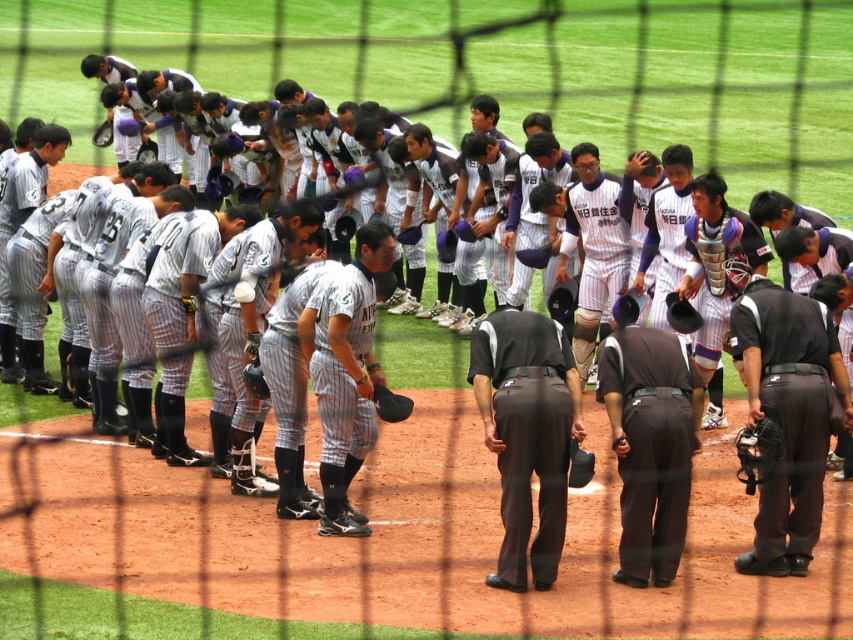
Question: Among these objects, which one is farthest from the camera?

Choices:
 (A) black leather baseball glove at center
 (B) dark brown uniform at center
 (C) dark gray pants at center

Answer: (A)

Question: Which point is closer to the camera taking this photo?

Choices:
 (A) (387, 420)
 (B) (498, 563)

Answer: (B)

Question: Is dark brown uniform at center to the right of black leather baseball glove at center from the viewer's perspective?

Choices:
 (A) no
 (B) yes

Answer: (B)

Question: Considering the relative positions of dark brown uniform at center and black leather baseball glove at center in the image provided, where is dark brown uniform at center located with respect to black leather baseball glove at center?

Choices:
 (A) right
 (B) left

Answer: (A)

Question: Considering the relative positions of dark gray pants at center and dark brown uniform at center in the image provided, where is dark gray pants at center located with respect to dark brown uniform at center?

Choices:
 (A) above
 (B) below

Answer: (B)

Question: Which point is farther from the camera taking this photo?

Choices:
 (A) (254, 248)
 (B) (408, 397)

Answer: (A)